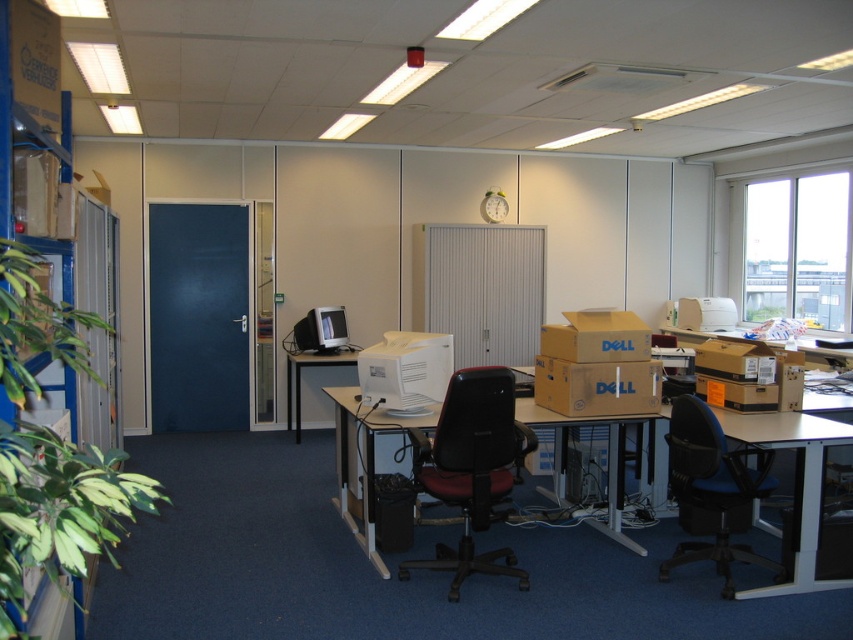
You are standing at the entrance of the office and want to sit down in the black leather swivel chair at center. According to the scene description, where should you head towards?

The black leather swivel chair at center is located at point (471, 468), so you should head towards that coordinate to reach it.

You are a delivery person who needs to deliver a package to the desk in this office. The package is 3 meters long. Can you place the package horizontally between the black leather swivel chair at center and the matte black monitor at center left without bending it?

The distance between the black leather swivel chair at center and the matte black monitor at center left is 3.41 meters. Since the package is 3 meters long, it can be placed horizontally between them without bending.

You are an office worker who needs to move the cardboard box at center to make space for a new printer. Which direction should you move it so that the green leafy plant at left is still visible from your desk?

The green leafy plant at left is on the left side of the cardboard box at center. To keep the plant visible, move the box to the right side of the plant.